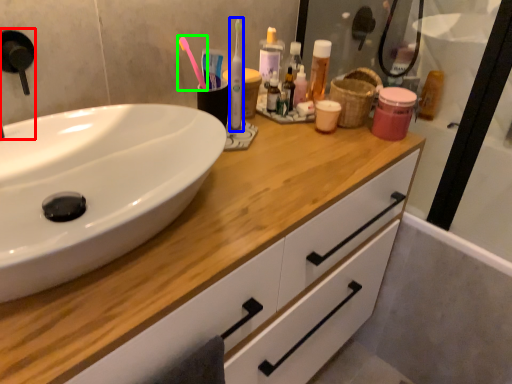
Question: Estimate the real-world distances between objects in this image. Which object is closer to faucet (highlighted by a red box), toothbrush (highlighted by a blue box) or toothbrush (highlighted by a green box)?

Choices:
 (A) toothbrush
 (B) toothbrush

Answer: (B)